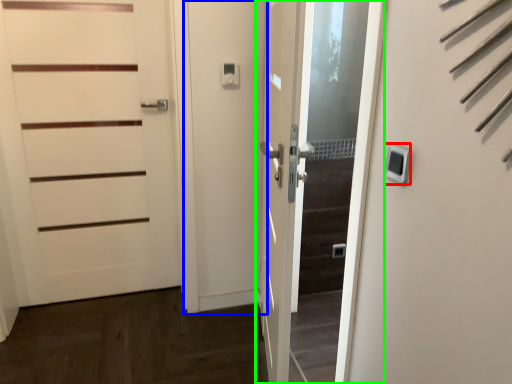
Question: Considering the real-world distances, which object is closest to thermostat (highlighted by a red box)? screen door (highlighted by a blue box) or door (highlighted by a green box).

Choices:
 (A) screen door
 (B) door

Answer: (B)